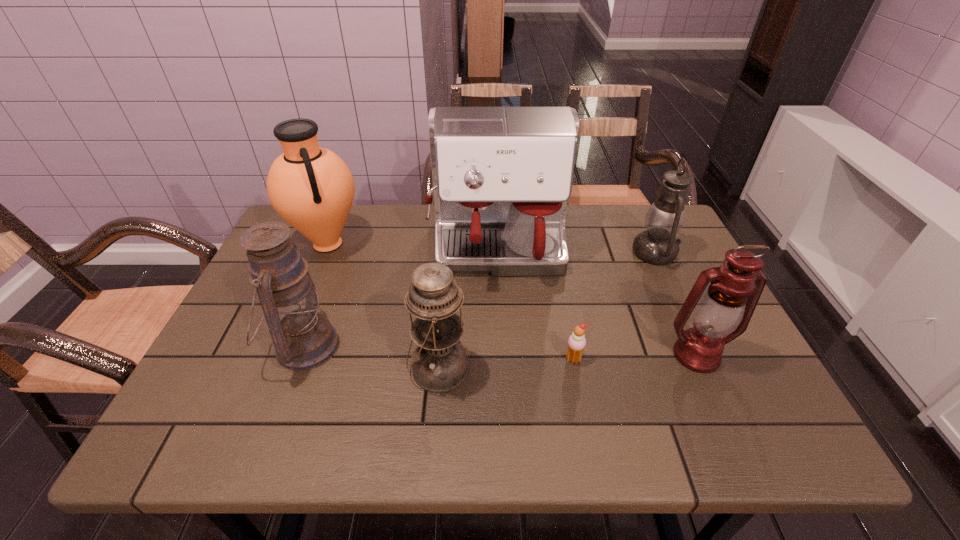
Find the location of a particular element. vacant space at the near edge of the desktop is located at coordinates (344, 426).

The width and height of the screenshot is (960, 540). Identify the location of vacant space at the left edge of the desktop. [243, 308].

Where is `vacant space at the right edge`? The height and width of the screenshot is (540, 960). vacant space at the right edge is located at coordinates (743, 401).

The width and height of the screenshot is (960, 540). Find the location of `free spot at the far left corner of the desktop`. free spot at the far left corner of the desktop is located at coordinates (299, 236).

You are a GUI agent. You are given a task and a screenshot of the screen. Output one action in this format:
    pyautogui.click(x=<x>, y=<y>)
    Task: Click on the vacant area that lies between the leftmost oil lamp and the coffee maker
    This screenshot has height=540, width=960.
    Given the screenshot: What is the action you would take?
    pyautogui.click(x=401, y=300)

Identify the location of vacant area between the coffee maker and the farthest oil lamp. (576, 253).

Locate an element on the screen. This screenshot has height=540, width=960. vacant region between the leftmost oil lamp and the coffee maker is located at coordinates (401, 300).

What are the coordinates of `free point between the leftmost oil lamp and the farthest oil lamp` in the screenshot? It's located at (480, 299).

What are the coordinates of `empty space that is in between the leftmost oil lamp and the third oil lamp from right to left` in the screenshot? It's located at (372, 358).

The width and height of the screenshot is (960, 540). I want to click on free spot between the coffee maker and the shortest object, so click(x=536, y=306).